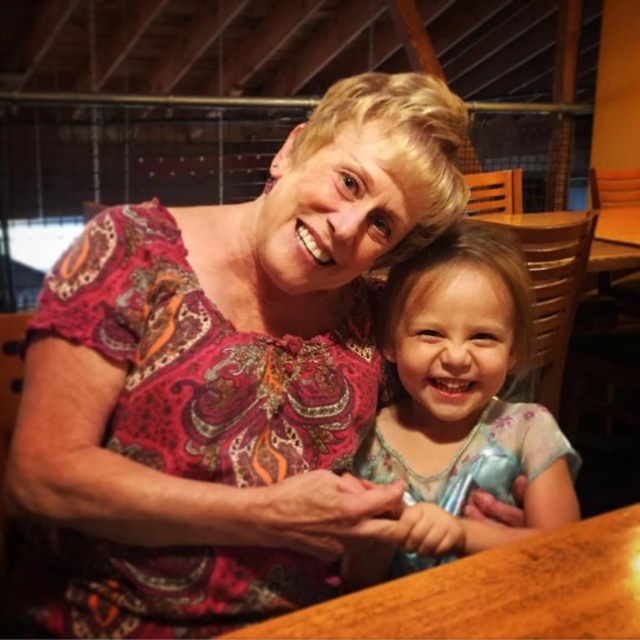
Consider the image. Which is below, patterned fabric blouse at upper left or wooden table at center?

wooden table at center

The height and width of the screenshot is (640, 640). I want to click on patterned fabric blouse at upper left, so click(x=221, y=378).

Is patterned fabric blouse at upper left below light blue floral dress at center?

No.

Between point (106, 280) and point (394, 288), which one is positioned behind?

The point (394, 288) is more distant.

At what (x,y) coordinates should I click in order to perform the action: click on patterned fabric blouse at upper left. Please return your answer as a coordinate pair (x, y). Image resolution: width=640 pixels, height=640 pixels. Looking at the image, I should click on (221, 378).

Does light blue floral dress at center lie behind wooden table at center?

Yes.

Is light blue floral dress at center below wooden table at center?

Actually, light blue floral dress at center is above wooden table at center.

At what (x,y) coordinates should I click in order to perform the action: click on light blue floral dress at center. Please return your answer as a coordinate pair (x, y). Image resolution: width=640 pixels, height=640 pixels. Looking at the image, I should click on (464, 390).

At what (x,y) coordinates should I click in order to perform the action: click on light blue floral dress at center. Please return your answer as a coordinate pair (x, y). The width and height of the screenshot is (640, 640). Looking at the image, I should click on (464, 390).